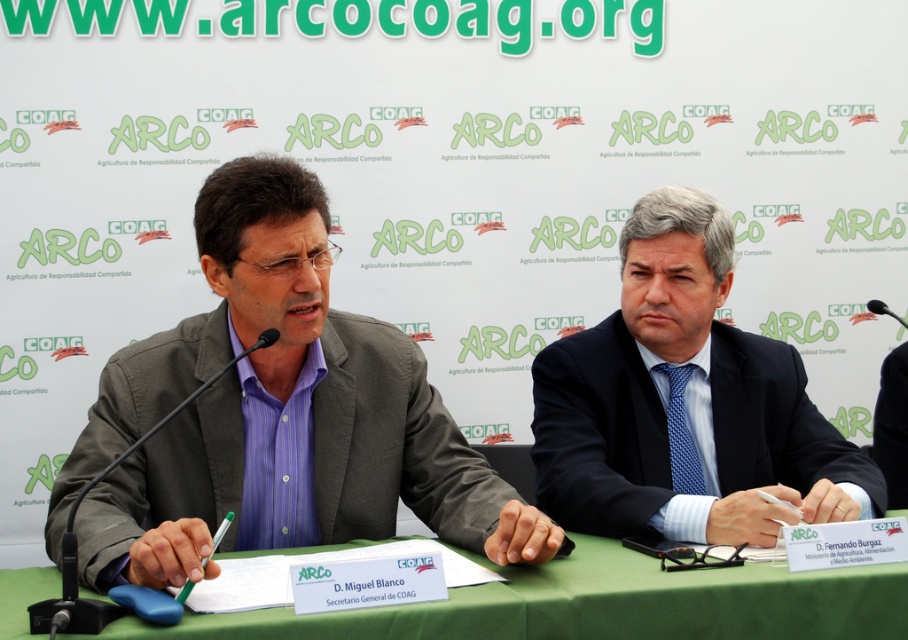
Can you confirm if dark blue suit at center is positioned above green fabric table at center?

Yes.

Is dark blue suit at center below green fabric table at center?

Incorrect, dark blue suit at center is not positioned below green fabric table at center.

Identify the location of dark blue suit at center. (686, 403).

At what (x,y) coordinates should I click in order to perform the action: click on dark blue suit at center. Please return your answer as a coordinate pair (x, y). The height and width of the screenshot is (640, 908). Looking at the image, I should click on (686, 403).

Who is more distant from viewer, (173,547) or (258,339)?

Positioned behind is point (258,339).

This screenshot has width=908, height=640. What do you see at coordinates (275, 413) in the screenshot?
I see `matte gray suit at center` at bounding box center [275, 413].

Does point (314, 468) come behind point (64, 557)?

Yes, point (314, 468) is farther from viewer.

You are a GUI agent. You are given a task and a screenshot of the screen. Output one action in this format:
    pyautogui.click(x=<x>, y=<y>)
    Task: Click on the matte gray suit at center
    
    Given the screenshot: What is the action you would take?
    pyautogui.click(x=275, y=413)

At what (x,y) coordinates should I click in order to perform the action: click on dark blue suit at center. Please return your answer as a coordinate pair (x, y). Looking at the image, I should click on (686, 403).